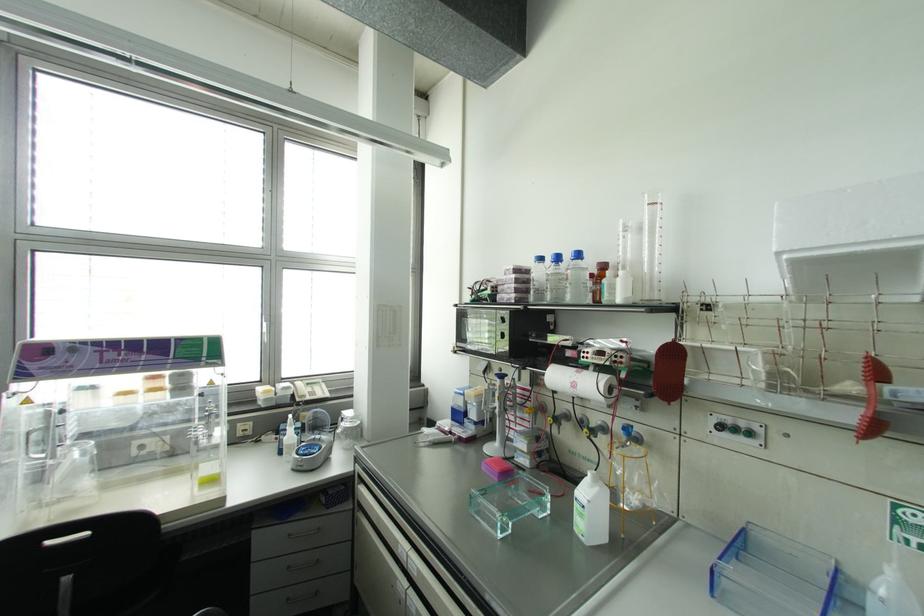
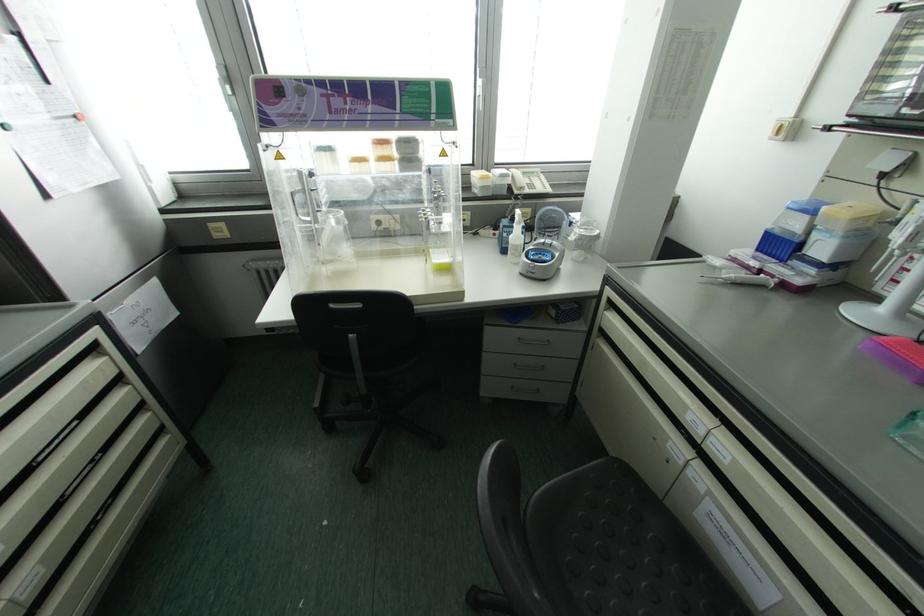
Where in the second image is the point corresponding to the point at 289,436 from the first image?

(516, 235)